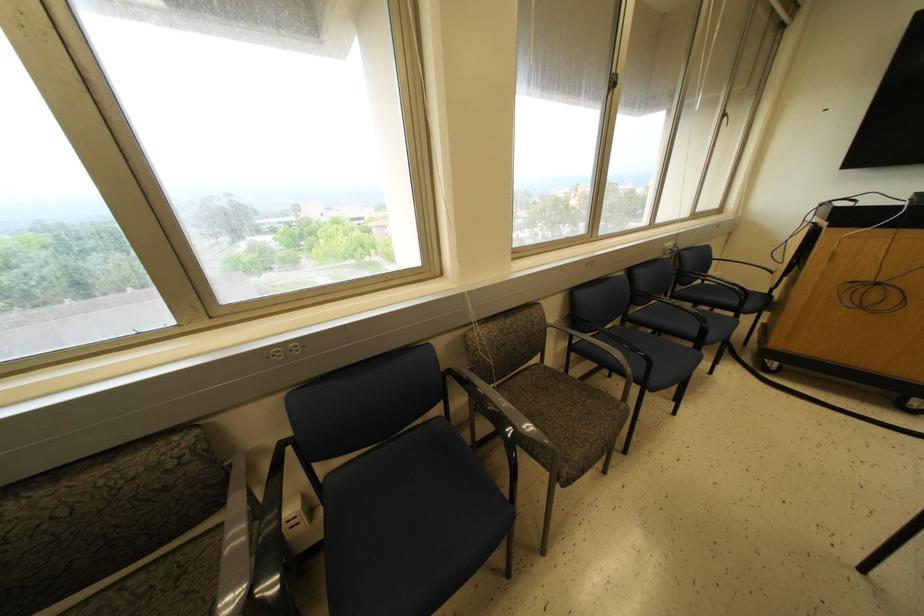
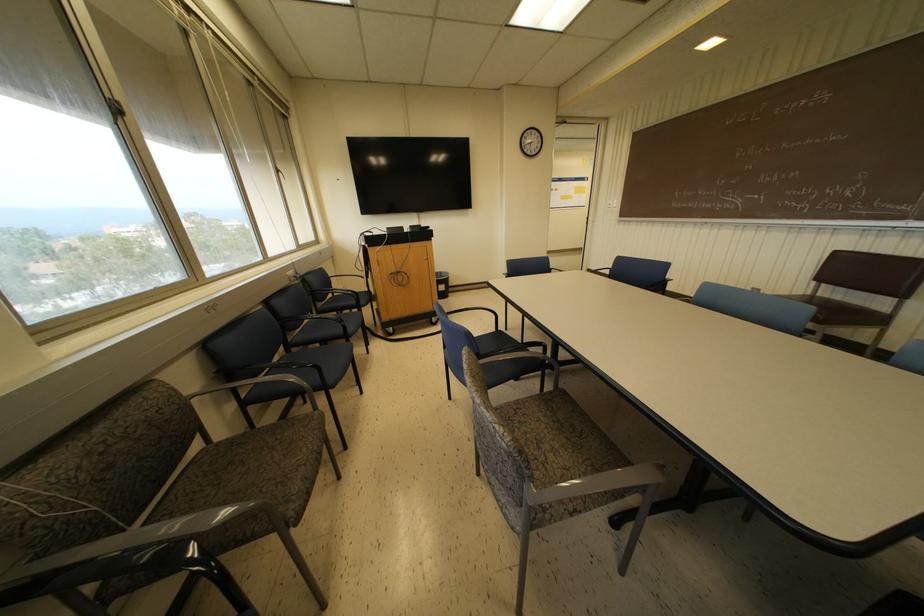
Where in the second image is the point corresponding to [669,244] from the first image?

(289, 272)